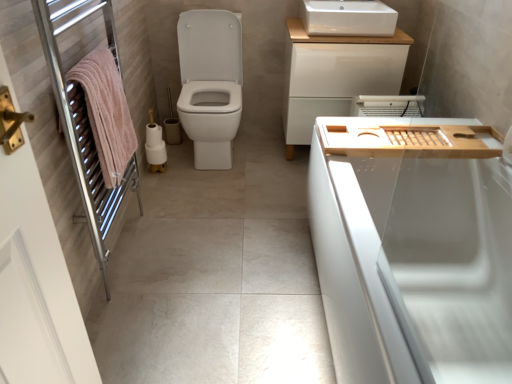
Locate an element on the screen. This screenshot has height=384, width=512. empty space that is in between white glossy toilet at center and pink towel at left is located at coordinates (170, 210).